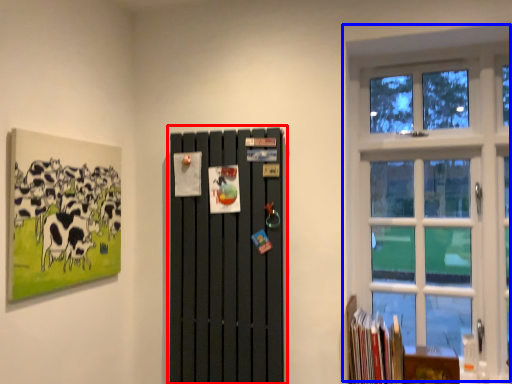
Question: Among these objects, which one is nearest to the camera, barn door (highlighted by a red box) or window (highlighted by a blue box)?

Choices:
 (A) barn door
 (B) window

Answer: (A)